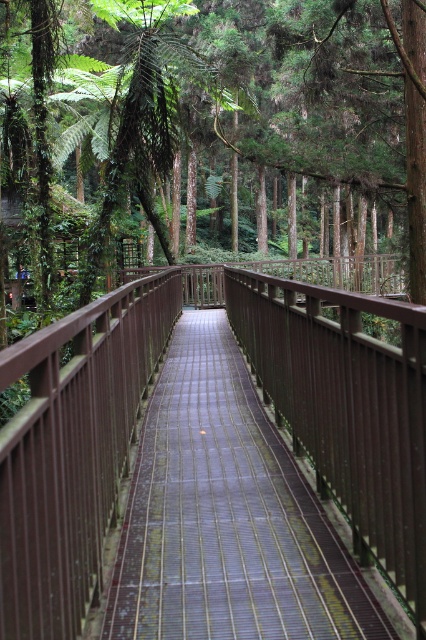
Question: Does green leafy forest at center have a larger size compared to brown wooden rail at center?

Choices:
 (A) yes
 (B) no

Answer: (A)

Question: Which object appears closest to the camera in this image?

Choices:
 (A) brown wooden rail at center
 (B) brown wooden bridge at center
 (C) green leafy forest at center

Answer: (A)

Question: Does green leafy forest at center come behind brown wooden bridge at center?

Choices:
 (A) no
 (B) yes

Answer: (B)

Question: Which point appears farthest from the camera in this image?

Choices:
 (A) (235, 161)
 (B) (339, 380)
 (C) (236, 380)

Answer: (A)

Question: Which object is the farthest from the brown wooden bridge at center?

Choices:
 (A) brown wooden rail at center
 (B) green leafy forest at center

Answer: (B)

Question: Where is brown wooden bridge at center located in relation to brown wooden rail at center in the image?

Choices:
 (A) left
 (B) right

Answer: (A)